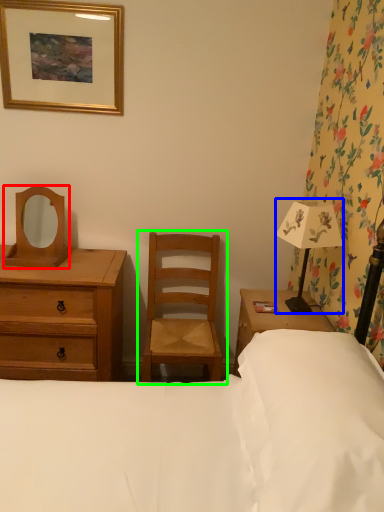
Question: Which is nearer to the mirror (highlighted by a red box)? bedside lamp (highlighted by a blue box) or chair (highlighted by a green box).

Choices:
 (A) bedside lamp
 (B) chair

Answer: (B)